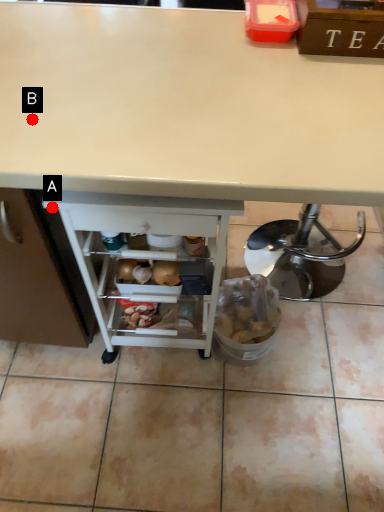
Question: Two points are circled on the image, labeled by A and B beside each circle. Which point is closer to the camera?

Choices:
 (A) A is closer
 (B) B is closer

Answer: (B)